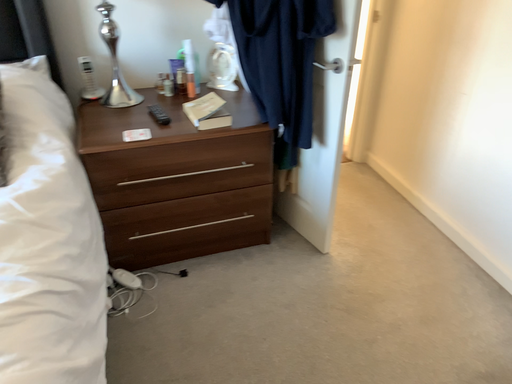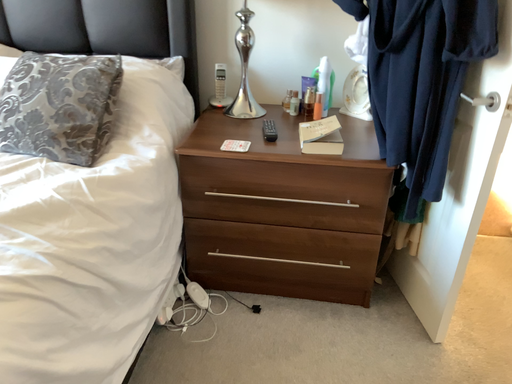
Question: Which way did the camera rotate in the video?

Choices:
 (A) rotated right
 (B) rotated left

Answer: (B)